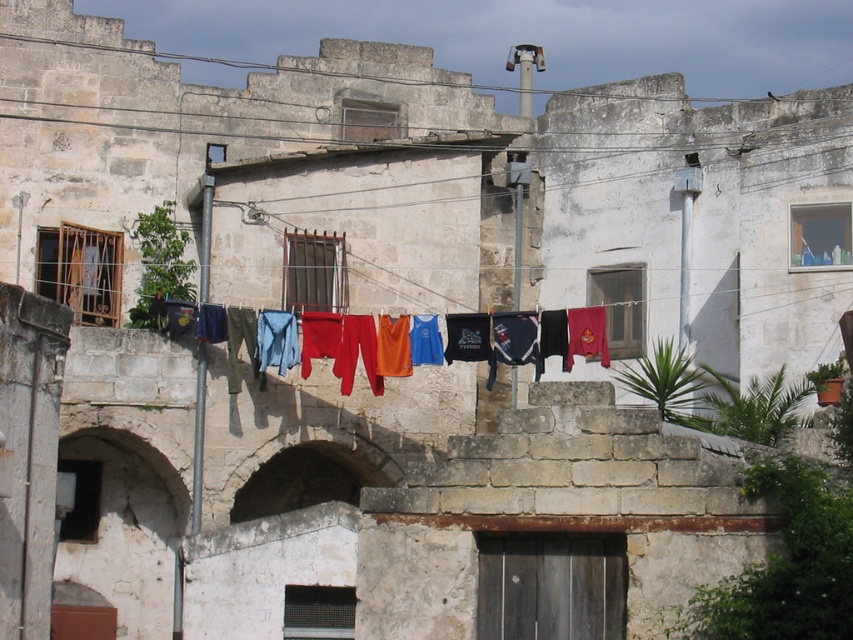
Who is more distant from viewer, (277, 492) or (343, 336)?

The point (277, 492) is more distant.

Does stone archway at center have a greater width compared to multicolored fabric at center?

In fact, stone archway at center might be narrower than multicolored fabric at center.

The image size is (853, 640). In order to click on stone archway at center in this screenshot , I will do `click(310, 472)`.

I want to click on stone archway at center, so click(x=310, y=472).